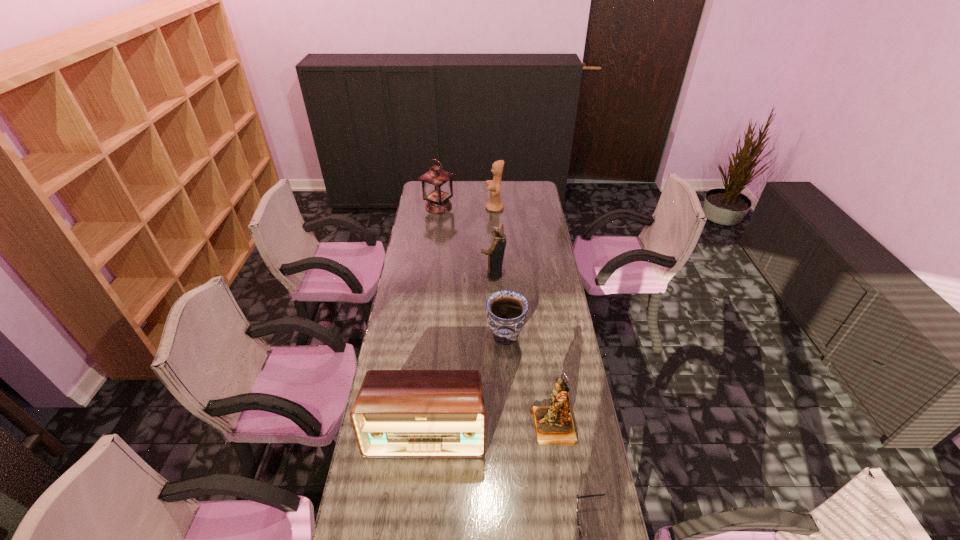
Locate an element on the screen. free space located on the right of the oil lamp is located at coordinates (486, 207).

Where is `vacant region located 0.330m on the front-facing side of the second nearest figurine`? This screenshot has width=960, height=540. vacant region located 0.330m on the front-facing side of the second nearest figurine is located at coordinates (412, 274).

Locate an element on the screen. Image resolution: width=960 pixels, height=540 pixels. free space located 0.200m on the front-facing side of the second nearest figurine is located at coordinates (439, 274).

Find the location of a particular element. This screenshot has width=960, height=540. vacant space located 0.380m on the front-facing side of the second nearest figurine is located at coordinates (401, 274).

Identify the location of free point located 0.320m on the front-facing side of the rightmost figurine. (438, 428).

This screenshot has height=540, width=960. Find the location of `vacant space situated 0.170m on the front-facing side of the rightmost figurine`. vacant space situated 0.170m on the front-facing side of the rightmost figurine is located at coordinates (482, 428).

This screenshot has height=540, width=960. What are the coordinates of `vacant area situated on the front-facing side of the rightmost figurine` in the screenshot? It's located at (467, 428).

Identify the location of blank area located 0.080m on the front-facing side of the radio receiver. Image resolution: width=960 pixels, height=540 pixels. (420, 484).

Find the location of a particular element. blank area located 0.180m on the front handle of the fourth nearest object is located at coordinates tap(442, 336).

Where is `free spot located on the front handle of the fourth nearest object`? The image size is (960, 540). free spot located on the front handle of the fourth nearest object is located at coordinates coord(400,336).